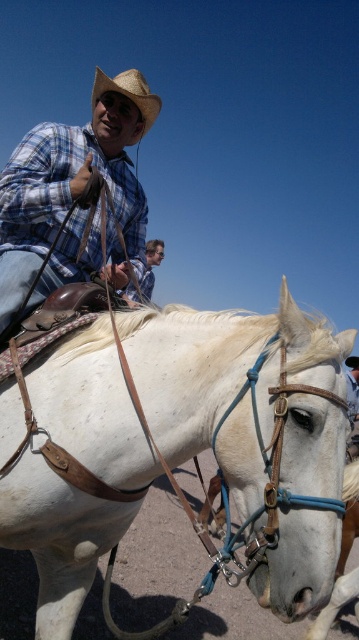
Is plaid cotton shirt at upper left in front of light brown leather belt at upper center?

Yes, plaid cotton shirt at upper left is closer to the viewer.

Image resolution: width=359 pixels, height=640 pixels. What do you see at coordinates (72, 195) in the screenshot?
I see `plaid cotton shirt at upper left` at bounding box center [72, 195].

Image resolution: width=359 pixels, height=640 pixels. Describe the element at coordinates (72, 195) in the screenshot. I see `plaid cotton shirt at upper left` at that location.

This screenshot has width=359, height=640. In order to click on plaid cotton shirt at upper left in this screenshot , I will do (x=72, y=195).

Can you confirm if plaid cotton shirt at upper left is positioned to the right of straw hat at upper center?

Yes, plaid cotton shirt at upper left is to the right of straw hat at upper center.

The width and height of the screenshot is (359, 640). Describe the element at coordinates (72, 195) in the screenshot. I see `plaid cotton shirt at upper left` at that location.

Between point (20, 227) and point (131, 70), which one is positioned in front?

Point (20, 227) is more forward.

Identify the location of plaid cotton shirt at upper left. (72, 195).

Does straw hat at upper center lie behind light brown leather belt at upper center?

Yes, it is.

Is point (146, 88) positioned in front of point (156, 243)?

Yes, it is in front of point (156, 243).

The height and width of the screenshot is (640, 359). Identify the location of straw hat at upper center. (128, 96).